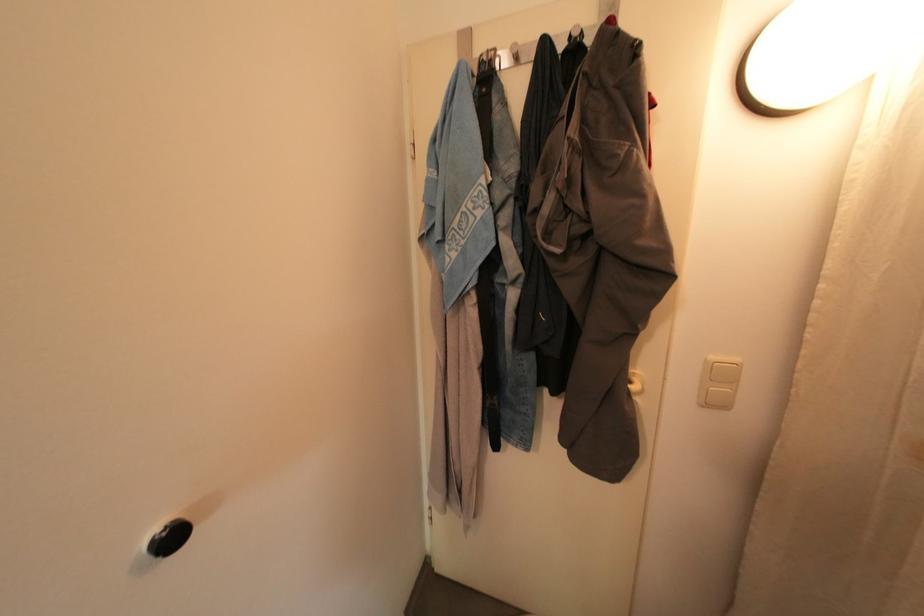
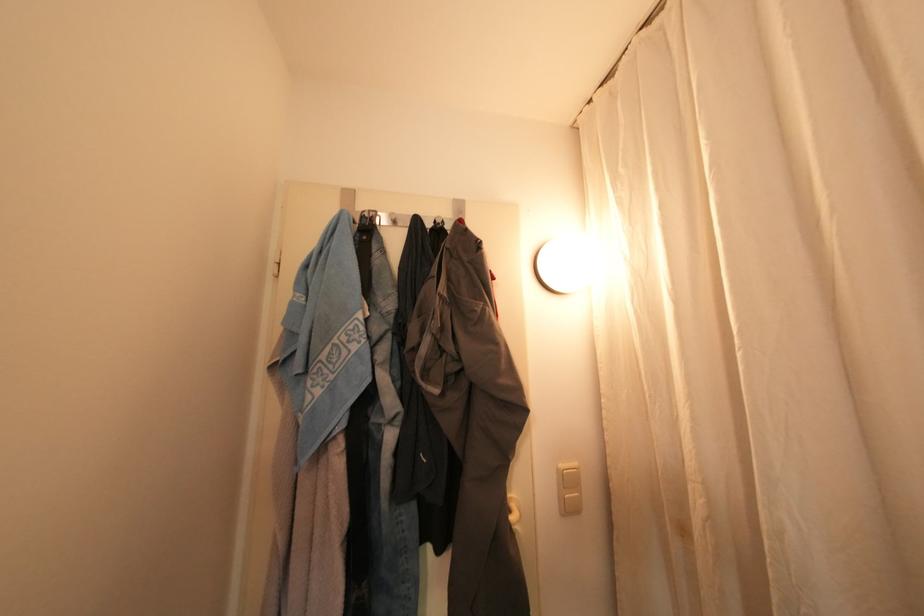
Find the pixel in the second image that matches (722,365) in the first image.

(568, 474)